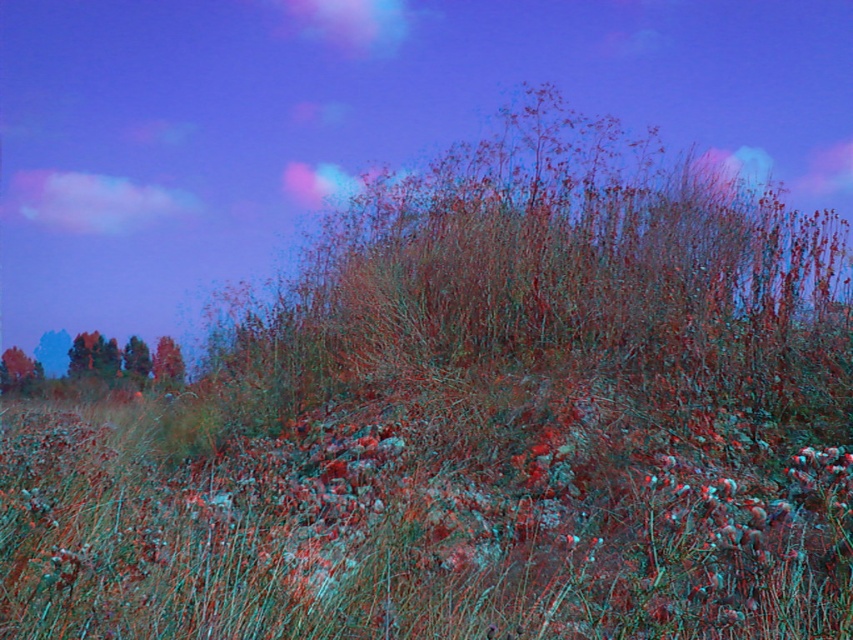
Question: Which point appears closest to the camera in this image?

Choices:
 (A) click(x=155, y=342)
 (B) click(x=364, y=461)

Answer: (B)

Question: Which object is farther from the camera taking this photo?

Choices:
 (A) smooth brown tree at lower left
 (B) green grass at center

Answer: (A)

Question: Does green grass at center appear on the right side of smooth brown tree at lower left?

Choices:
 (A) no
 (B) yes

Answer: (B)

Question: Can you confirm if green grass at center is thinner than smooth brown tree at lower left?

Choices:
 (A) yes
 (B) no

Answer: (B)

Question: Does green grass at center have a smaller size compared to smooth brown tree at lower left?

Choices:
 (A) yes
 (B) no

Answer: (B)